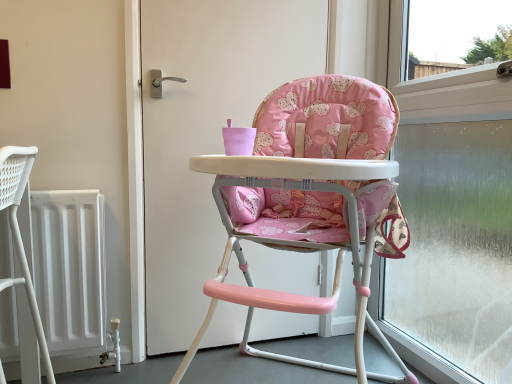
Question: Is frosted glass window at right shorter than pink fabric high chair at center?

Choices:
 (A) no
 (B) yes

Answer: (A)

Question: Does frosted glass window at right come in front of pink fabric high chair at center?

Choices:
 (A) yes
 (B) no

Answer: (A)

Question: Are frosted glass window at right and pink fabric high chair at center located far from each other?

Choices:
 (A) no
 (B) yes

Answer: (A)

Question: Considering the relative sizes of frosted glass window at right and pink fabric high chair at center in the image provided, is frosted glass window at right wider than pink fabric high chair at center?

Choices:
 (A) no
 (B) yes

Answer: (B)

Question: From the image's perspective, is frosted glass window at right on pink fabric high chair at center?

Choices:
 (A) yes
 (B) no

Answer: (B)

Question: Is frosted glass window at right further to camera compared to pink fabric high chair at center?

Choices:
 (A) yes
 (B) no

Answer: (B)

Question: Is frosted glass window at right facing away from pink fabric highchair at center?

Choices:
 (A) no
 (B) yes

Answer: (B)

Question: Is frosted glass window at right shorter than pink fabric highchair at center?

Choices:
 (A) yes
 (B) no

Answer: (B)

Question: Is frosted glass window at right to the right of pink fabric highchair at center from the viewer's perspective?

Choices:
 (A) no
 (B) yes

Answer: (B)

Question: Is frosted glass window at right aimed at pink fabric highchair at center?

Choices:
 (A) no
 (B) yes

Answer: (B)

Question: Is frosted glass window at right thinner than pink fabric highchair at center?

Choices:
 (A) no
 (B) yes

Answer: (B)

Question: Is frosted glass window at right directly adjacent to pink fabric highchair at center?

Choices:
 (A) no
 (B) yes

Answer: (A)

Question: Is pink fabric high chair at center surrounding frosted glass window at right?

Choices:
 (A) yes
 (B) no

Answer: (B)